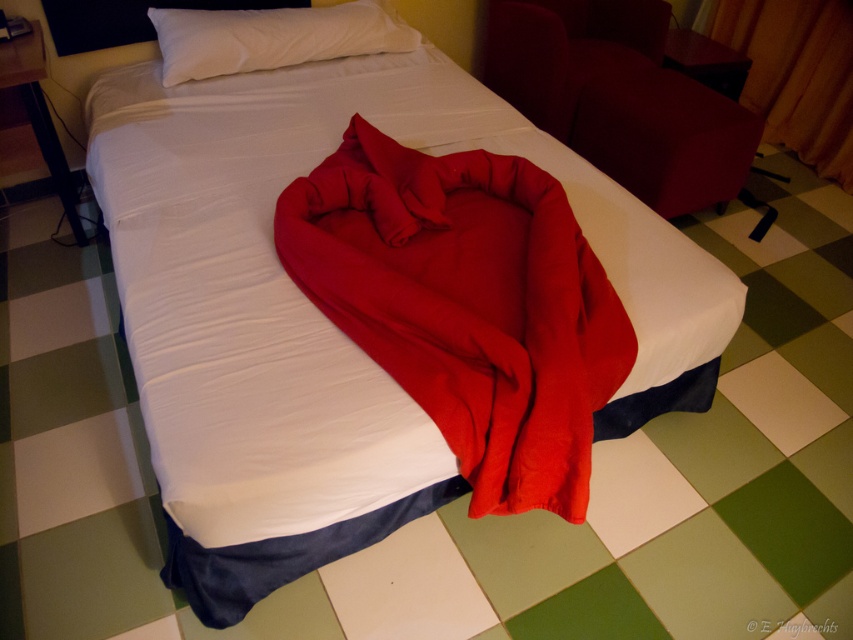
Does red soft fabric blanket at center have a lesser height compared to white soft pillow at upper center?

No.

Image resolution: width=853 pixels, height=640 pixels. Find the location of `red soft fabric blanket at center`. red soft fabric blanket at center is located at coordinates (466, 305).

Based on the photo, is orange fabric curtain at upper right positioned before white soft pillow at upper center?

No, it is not.

Is orange fabric curtain at upper right above white soft pillow at upper center?

Yes, orange fabric curtain at upper right is above white soft pillow at upper center.

Locate an element on the screen. orange fabric curtain at upper right is located at coordinates (798, 74).

Find the location of a particular element. Image resolution: width=853 pixels, height=640 pixels. red soft fabric blanket at center is located at coordinates (466, 305).

Is point (476, 282) in front of point (747, 90)?

Yes, it is.

Image resolution: width=853 pixels, height=640 pixels. Find the location of `red soft fabric blanket at center`. red soft fabric blanket at center is located at coordinates (466, 305).